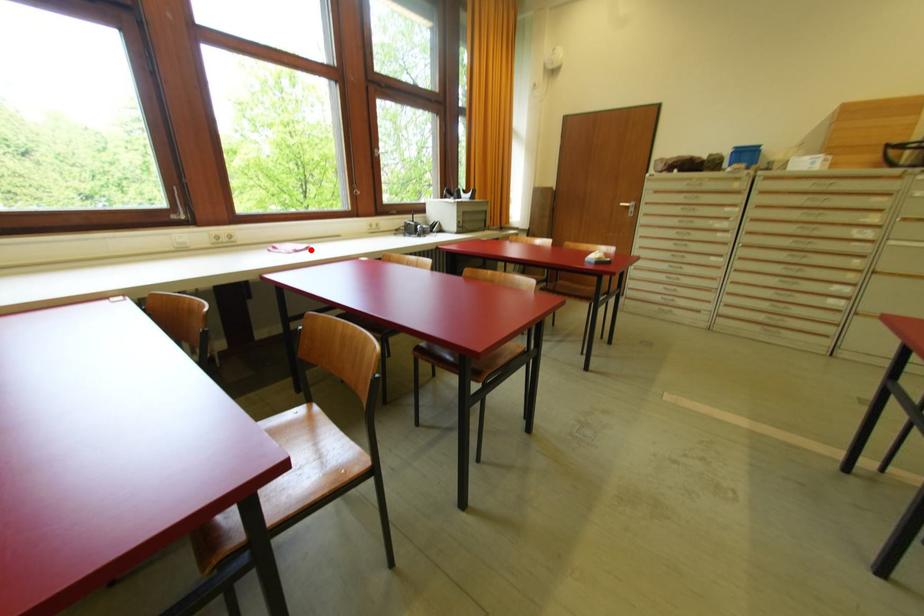
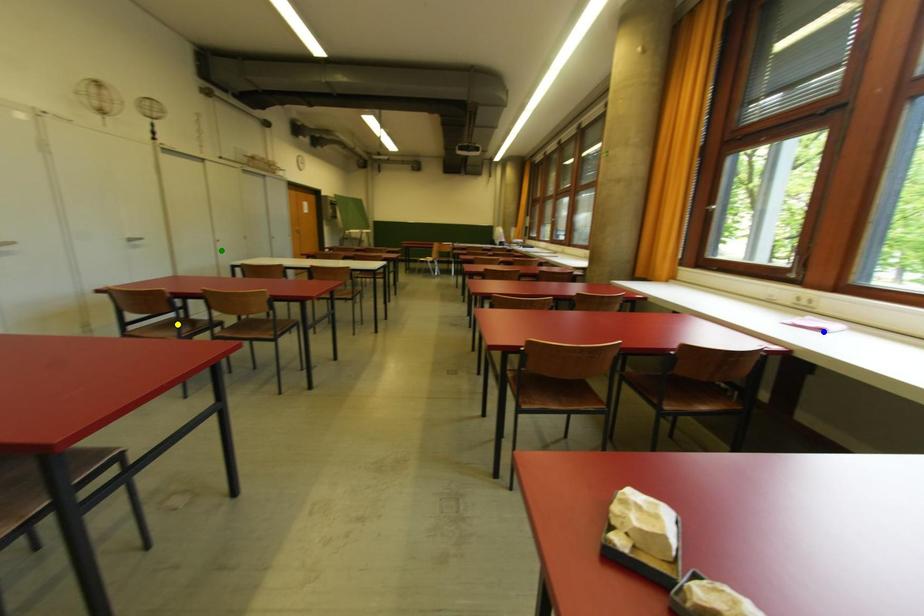
Question: I am providing you with two images of the same scene from different viewpoints. A red point is marked on the first image. You are given multiple points on the second image. Which mark in image 2 goes with the point in image 1?

Choices:
 (A) yellow point
 (B) green point
 (C) blue point

Answer: (C)